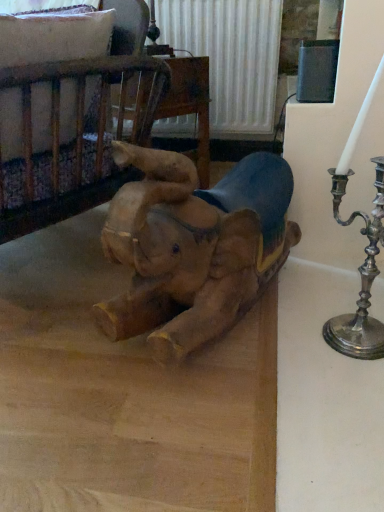
Question: From a real-world perspective, is wooden crib at upper left on wooden elephant at center?

Choices:
 (A) yes
 (B) no

Answer: (A)

Question: Could you tell me if wooden crib at upper left is facing wooden elephant at center?

Choices:
 (A) no
 (B) yes

Answer: (A)

Question: Is wooden crib at upper left oriented away from wooden elephant at center?

Choices:
 (A) yes
 (B) no

Answer: (A)

Question: Does wooden crib at upper left appear on the right side of wooden elephant at center?

Choices:
 (A) yes
 (B) no

Answer: (B)

Question: Is wooden crib at upper left taller than wooden elephant at center?

Choices:
 (A) yes
 (B) no

Answer: (B)

Question: Is wooden crib at upper left to the left or to the right of wooden elephant at center in the image?

Choices:
 (A) left
 (B) right

Answer: (A)

Question: In the image, is wooden crib at upper left positioned in front of or behind wooden elephant at center?

Choices:
 (A) behind
 (B) front

Answer: (A)

Question: From the image's perspective, is wooden crib at upper left located above or below wooden elephant at center?

Choices:
 (A) below
 (B) above

Answer: (B)

Question: From a real-world perspective, is wooden crib at upper left positioned above or below wooden elephant at center?

Choices:
 (A) below
 (B) above

Answer: (B)

Question: Is wooden crib at upper left wider or thinner than wooden elephant at center?

Choices:
 (A) wide
 (B) thin

Answer: (B)

Question: Is point (127, 173) positioned closer to the camera than point (109, 403)?

Choices:
 (A) farther
 (B) closer

Answer: (A)

Question: In the image, is wooden crib at upper left on the left side or the right side of wooden elephant at center?

Choices:
 (A) right
 (B) left

Answer: (B)

Question: Considering their positions, is wooden crib at upper left located in front of or behind wooden elephant at center?

Choices:
 (A) front
 (B) behind

Answer: (B)

Question: Would you say wooden elephant at center is inside or outside wooden crib at upper left?

Choices:
 (A) inside
 (B) outside

Answer: (B)

Question: Is wooden elephant at center taller or shorter than wooden crib at upper left?

Choices:
 (A) tall
 (B) short

Answer: (A)